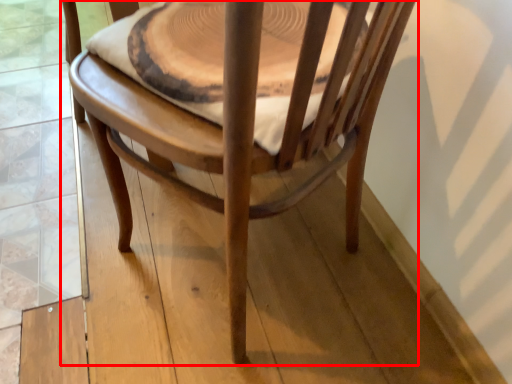
Question: From the image, what is the correct spatial relationship of chair (annotated by the red box) in relation to round table?

Choices:
 (A) left
 (B) right

Answer: (A)